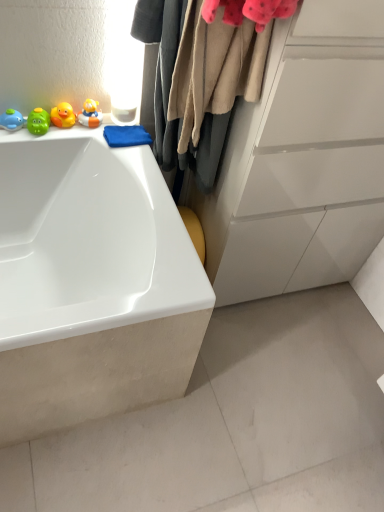
Question: Is white glossy bathtub at upper left to the right of matte blue whale at upper left, which ranks as the 1th toy in left-to-right order, from the viewer's perspective?

Choices:
 (A) yes
 (B) no

Answer: (A)

Question: Can you confirm if white glossy bathtub at upper left is thinner than matte blue whale at upper left, which ranks as the 1th toy in left-to-right order?

Choices:
 (A) no
 (B) yes

Answer: (A)

Question: Is white glossy bathtub at upper left to the left of matte blue whale at upper left, acting as the 4th toy starting from the right, from the viewer's perspective?

Choices:
 (A) yes
 (B) no

Answer: (B)

Question: Is white glossy bathtub at upper left touching matte blue whale at upper left, acting as the 4th toy starting from the right?

Choices:
 (A) yes
 (B) no

Answer: (B)

Question: Considering the relative sizes of white glossy bathtub at upper left and matte blue whale at upper left, acting as the 4th toy starting from the right, in the image provided, is white glossy bathtub at upper left shorter than matte blue whale at upper left, acting as the 4th toy starting from the right,?

Choices:
 (A) yes
 (B) no

Answer: (B)

Question: Would you say white glossy bathtub at upper left is outside matte blue whale at upper left, which ranks as the 1th toy in left-to-right order?

Choices:
 (A) yes
 (B) no

Answer: (A)

Question: Considering the relative sizes of beige woolen sweater at upper center and rubber duck at left, which is counted as the 3th toy, starting from the left, in the image provided, is beige woolen sweater at upper center wider than rubber duck at left, which is counted as the 3th toy, starting from the left,?

Choices:
 (A) yes
 (B) no

Answer: (A)

Question: Is the depth of beige woolen sweater at upper center greater than that of rubber duck at left, which is the second toy in right-to-left order?

Choices:
 (A) no
 (B) yes

Answer: (A)

Question: Does beige woolen sweater at upper center appear on the right side of rubber duck at left, which is counted as the 3th toy, starting from the left?

Choices:
 (A) yes
 (B) no

Answer: (A)

Question: From the image's perspective, does beige woolen sweater at upper center appear higher than rubber duck at left, which is counted as the 3th toy, starting from the left?

Choices:
 (A) yes
 (B) no

Answer: (B)

Question: Does beige woolen sweater at upper center have a larger size compared to rubber duck at left, which is counted as the 3th toy, starting from the left?

Choices:
 (A) yes
 (B) no

Answer: (A)

Question: Can you confirm if beige woolen sweater at upper center is shorter than rubber duck at left, which is counted as the 3th toy, starting from the left?

Choices:
 (A) no
 (B) yes

Answer: (A)

Question: Is rubber duck at left, which is counted as the 3th toy, starting from the left, bigger than rubber duck at upper left, the 4th toy in the left-to-right sequence?

Choices:
 (A) yes
 (B) no

Answer: (B)